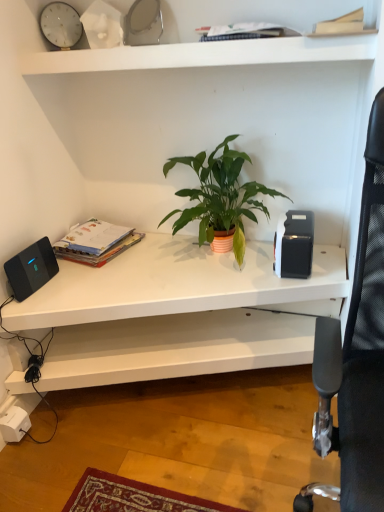
Where is `light brown paper at upper right, placed as the second paperback book when sorted from bottom to top`? This screenshot has width=384, height=512. light brown paper at upper right, placed as the second paperback book when sorted from bottom to top is located at coordinates (341, 24).

In order to face white matte desk at center, which ranks as the second shelf in top-to-bottom order, should I rotate leftwards or rightwards?

A 1.039 degree turn to the left will do.

Where is `white glossy clock at upper left`? white glossy clock at upper left is located at coordinates (61, 25).

Where is `black mesh computer chair at right`? The height and width of the screenshot is (512, 384). black mesh computer chair at right is located at coordinates (356, 356).

You are a GUI agent. You are given a task and a screenshot of the screen. Output one action in this format:
    pyautogui.click(x=<x>, y=<y>)
    Task: Click on the black plastic toaster at right
    The width and height of the screenshot is (384, 512).
    Given the screenshot: What is the action you would take?
    pyautogui.click(x=294, y=245)

Does matte paperbacks at left, arranged as the second paperback book when viewed from the front, have a greater height compared to black matte speaker at left?

Incorrect, the height of matte paperbacks at left, arranged as the second paperback book when viewed from the front, is not larger of that of black matte speaker at left.

Is matte paperbacks at left, arranged as the first paperback book when ordered from the bottom, looking in the opposite direction of black matte speaker at left?

That's not correct — matte paperbacks at left, arranged as the first paperback book when ordered from the bottom, is not looking away from black matte speaker at left.

Is matte paperbacks at left, arranged as the first paperback book when ordered from the bottom, positioned beyond the bounds of black matte speaker at left?

Yes, matte paperbacks at left, arranged as the first paperback book when ordered from the bottom, is outside of black matte speaker at left.

From a real-world perspective, which object rests below the other?

black plastic toaster at right, from a real-world perspective.

Does green matte plant at center have a lesser width compared to black plastic toaster at right?

In fact, green matte plant at center might be wider than black plastic toaster at right.

Consider the image. Considering the relative sizes of green matte plant at center and black plastic toaster at right in the image provided, is green matte plant at center smaller than black plastic toaster at right?

No.

Is green matte plant at center facing away from black plastic toaster at right?

No, green matte plant at center is not facing the opposite direction of black plastic toaster at right.

Consider the image. Can we say white matte shelf at upper center, positioned as the first shelf in top-to-bottom order, lies outside white glossy clock at upper left?

Absolutely, white matte shelf at upper center, positioned as the first shelf in top-to-bottom order, is external to white glossy clock at upper left.

From a real-world perspective, who is located higher, white matte shelf at upper center, the second shelf from the bottom, or white glossy clock at upper left?

From a 3D spatial view, white glossy clock at upper left is above.

Considering the positions of point (227, 63) and point (42, 13), is point (227, 63) closer or farther from the camera than point (42, 13)?

Point (227, 63) appears to be closer to the viewer than point (42, 13).

From the picture: Is white glossy clock at upper left not close to black mesh computer chair at right?

Yes.

This screenshot has height=512, width=384. What are the coordinates of `clock above the black mesh computer chair at right (from a real-world perspective)` in the screenshot? It's located at (61, 25).

Does white glossy clock at upper left have a greater height compared to black mesh computer chair at right?

Incorrect, the height of white glossy clock at upper left is not larger of that of black mesh computer chair at right.

Would you say black mesh computer chair at right is part of white glossy clock at upper left's contents?

No, black mesh computer chair at right is not inside white glossy clock at upper left.

How many degrees apart are the facing directions of white matte shelf at upper center, positioned as the first shelf in top-to-bottom order, and black matte speaker at left?

The facing directions of white matte shelf at upper center, positioned as the first shelf in top-to-bottom order, and black matte speaker at left are 89.6 degrees apart.

How distant is white matte shelf at upper center, positioned as the first shelf in top-to-bottom order, from black matte speaker at left?

white matte shelf at upper center, positioned as the first shelf in top-to-bottom order, is 30.14 inches from black matte speaker at left.

Is white matte shelf at upper center, positioned as the first shelf in top-to-bottom order, spatially inside black matte speaker at left, or outside of it?

white matte shelf at upper center, positioned as the first shelf in top-to-bottom order, is located beyond the bounds of black matte speaker at left.

From the picture: Are white matte shelf at upper center, the second shelf from the bottom, and black matte speaker at left located far from each other?

white matte shelf at upper center, the second shelf from the bottom, is actually quite close to black matte speaker at left.

Considering the relative positions of black matte speaker at left and black plastic toaster at right in the image provided, is black matte speaker at left to the left of black plastic toaster at right from the viewer's perspective?

Yes, black matte speaker at left is to the left of black plastic toaster at right.

Is black matte speaker at left wider than black plastic toaster at right?

In fact, black matte speaker at left might be narrower than black plastic toaster at right.

Does point (34, 277) appear closer or farther from the camera than point (277, 233)?

Point (34, 277) is closer to the camera than point (277, 233).

Is black matte speaker at left not inside black plastic toaster at right?

black matte speaker at left lies outside black plastic toaster at right's area.

Considering the positions of point (60, 337) and point (202, 49), is point (60, 337) closer or farther from the camera than point (202, 49)?

Point (60, 337) appears to be farther away from the viewer than point (202, 49).

Which of these two, white matte desk at center, placed as the first shelf when sorted from bottom to top, or white matte shelf at upper center, the second shelf from the bottom, stands taller?

With more height is white matte desk at center, placed as the first shelf when sorted from bottom to top.

In the scene shown: Is white matte desk at center, placed as the first shelf when sorted from bottom to top, facing away from white matte shelf at upper center, the second shelf from the bottom?

white matte desk at center, placed as the first shelf when sorted from bottom to top, is not turned away from white matte shelf at upper center, the second shelf from the bottom.

Which is correct: white matte desk at center, which ranks as the second shelf in top-to-bottom order, is inside white matte shelf at upper center, positioned as the first shelf in top-to-bottom order, or outside of it?

The correct answer is: outside.

Identify the location of speaker above the matte paperbacks at left, acting as the 2th paperback book starting from the top (from a real-world perspective). (31, 269).

You are a GUI agent. You are given a task and a screenshot of the screen. Output one action in this format:
    pyautogui.click(x=<x>, y=<y>)
    Task: Click on the gadget below the green matte plant at center (from a real-world perspective)
    Image resolution: width=384 pixels, height=512 pixels.
    Given the screenshot: What is the action you would take?
    pyautogui.click(x=294, y=245)

When comparing their distances from white matte shelf at upper center, the second shelf from the bottom, does black matte speaker at left or white matte desk at center, placed as the first shelf when sorted from bottom to top, seem further?

white matte desk at center, placed as the first shelf when sorted from bottom to top.

From the image, which object appears to be nearer to black plastic toaster at right, white matte shelf at upper center, the second shelf from the bottom, or green matte plant at center?

green matte plant at center lies closer to black plastic toaster at right than the other object.

From the image, which object appears to be nearer to black plastic toaster at right, white glossy clock at upper left or black mesh computer chair at right?

Among the two, black mesh computer chair at right is located nearer to black plastic toaster at right.

From the image, which object appears to be farther from light brown paper at upper right, the 2th paperback book in the left-to-right sequence, white matte desk at center, which ranks as the second shelf in top-to-bottom order, or matte paperbacks at left, arranged as the first paperback book when ordered from the bottom?

Based on the image, matte paperbacks at left, arranged as the first paperback book when ordered from the bottom, appears to be further to light brown paper at upper right, the 2th paperback book in the left-to-right sequence.

Estimate the real-world distances between objects in this image. Which object is further from black mesh computer chair at right, white matte shelf at upper center, positioned as the first shelf in top-to-bottom order, or white glossy clock at upper left?

The object further to black mesh computer chair at right is white glossy clock at upper left.

Which object lies nearer to the anchor point white matte desk at center, placed as the first shelf when sorted from bottom to top, light brown paper at upper right, the first paperback book from the top, or black matte speaker at left?

The object closer to white matte desk at center, placed as the first shelf when sorted from bottom to top, is black matte speaker at left.

When comparing their distances from white glossy clock at upper left, does black mesh computer chair at right or white matte desk at center, which ranks as the second shelf in top-to-bottom order, seem closer?

Among the two, white matte desk at center, which ranks as the second shelf in top-to-bottom order, is located nearer to white glossy clock at upper left.

Which object lies nearer to the anchor point green matte plant at center, light brown paper at upper right, the 2th paperback book in the left-to-right sequence, or white matte desk at center, placed as the first shelf when sorted from bottom to top?

The object closer to green matte plant at center is white matte desk at center, placed as the first shelf when sorted from bottom to top.

Find the location of a particular element. houseplant between black mesh computer chair at right and matte paperbacks at left, arranged as the second paperback book when viewed from the front, along the z-axis is located at coordinates (219, 196).

Find the location of a particular element. gadget between matte paperbacks at left, which is the 1th paperback book from left to right, and light brown paper at upper right, placed as the second paperback book when sorted from bottom to top is located at coordinates (294, 245).

This screenshot has height=512, width=384. In order to click on speaker between white glossy clock at upper left and white matte desk at center, placed as the first shelf when sorted from bottom to top, in the up-down direction in this screenshot , I will do `click(31, 269)`.

You are a GUI agent. You are given a task and a screenshot of the screen. Output one action in this format:
    pyautogui.click(x=<x>, y=<y>)
    Task: Click on the houseplant between white glossy clock at upper left and black matte speaker at left in the vertical direction
    
    Given the screenshot: What is the action you would take?
    pyautogui.click(x=219, y=196)